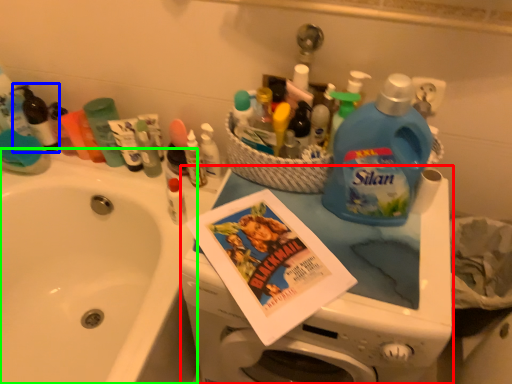
Question: Based on their relative distances, which object is farther from appliance (highlighted by a red box)? Choose from toiletry (highlighted by a blue box) and sink (highlighted by a green box).

Choices:
 (A) toiletry
 (B) sink

Answer: (A)